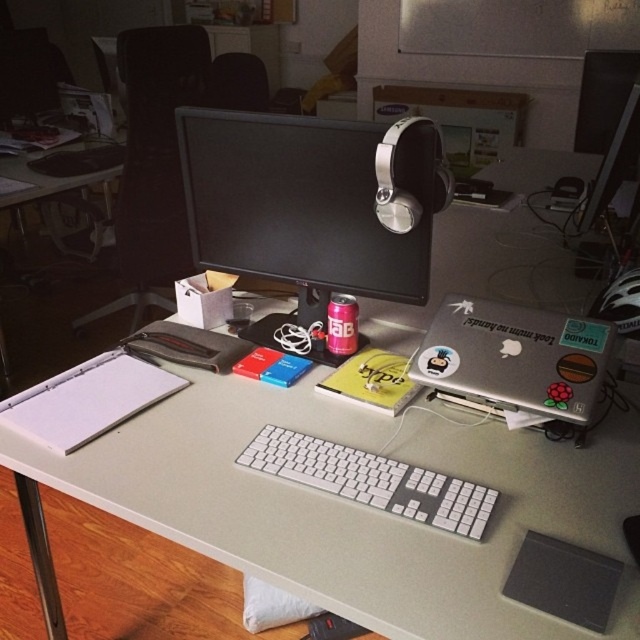
Question: Which point is closer to the camera?

Choices:
 (A) matte black monitor at upper center
 (B) white plastic keyboard at center
 (C) white plastic table at upper left
 (D) silver metallic laptop at center

Answer: (B)

Question: Does matte black monitor at center lie in front of silver metallic laptop at center?

Choices:
 (A) yes
 (B) no

Answer: (B)

Question: Can you confirm if white plastic keyboard at center is positioned to the right of matte black monitor at upper center?

Choices:
 (A) no
 (B) yes

Answer: (A)

Question: Which object is farther from the camera taking this photo?

Choices:
 (A) matte black monitor at center
 (B) white plastic keyboard at center
 (C) silver metallic laptop at center
 (D) matte black monitor at upper center

Answer: (D)

Question: Can you confirm if silver metallic laptop at center is smaller than white plastic table at upper left?

Choices:
 (A) yes
 (B) no

Answer: (A)

Question: Which point is farther from the camera taking this photo?

Choices:
 (A) (381, 467)
 (B) (227, 240)
 (C) (513, 372)
 (D) (0, 209)

Answer: (D)